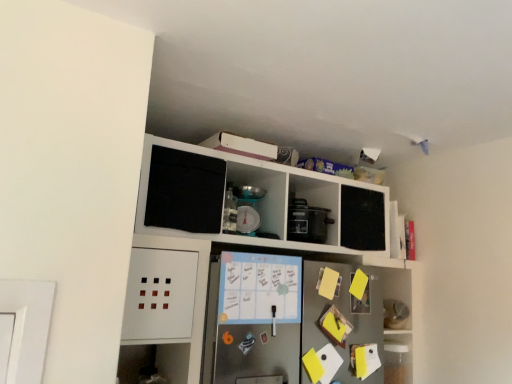
Question: Can you confirm if white matte cabinet at upper center is thinner than matte black rice cooker at center?

Choices:
 (A) yes
 (B) no

Answer: (B)

Question: Considering the relative positions of white matte cabinet at upper center and matte black rice cooker at center in the image provided, is white matte cabinet at upper center to the left of matte black rice cooker at center from the viewer's perspective?

Choices:
 (A) no
 (B) yes

Answer: (B)

Question: Is white matte cabinet at upper center positioned beyond the bounds of matte black rice cooker at center?

Choices:
 (A) yes
 (B) no

Answer: (A)

Question: Does white matte cabinet at upper center have a smaller size compared to matte black rice cooker at center?

Choices:
 (A) yes
 (B) no

Answer: (B)

Question: Is matte black rice cooker at center a part of white matte cabinet at upper center?

Choices:
 (A) yes
 (B) no

Answer: (A)

Question: Does white matte cabinet at upper center have a lesser height compared to matte black rice cooker at center?

Choices:
 (A) no
 (B) yes

Answer: (A)

Question: Is matte black rice cooker at center taller than metallic scale at upper center?

Choices:
 (A) no
 (B) yes

Answer: (A)

Question: Can you confirm if matte black rice cooker at center is wider than metallic scale at upper center?

Choices:
 (A) no
 (B) yes

Answer: (B)

Question: Would you say metallic scale at upper center is part of matte black rice cooker at center's contents?

Choices:
 (A) yes
 (B) no

Answer: (B)

Question: Is matte black rice cooker at center smaller than metallic scale at upper center?

Choices:
 (A) yes
 (B) no

Answer: (B)

Question: Is matte black rice cooker at center placed right next to metallic scale at upper center?

Choices:
 (A) no
 (B) yes

Answer: (A)

Question: Is matte black rice cooker at center to the right of metallic scale at upper center from the viewer's perspective?

Choices:
 (A) no
 (B) yes

Answer: (B)

Question: Considering the relative sizes of metallic scale at upper center and matte black rice cooker at center in the image provided, is metallic scale at upper center taller than matte black rice cooker at center?

Choices:
 (A) yes
 (B) no

Answer: (A)